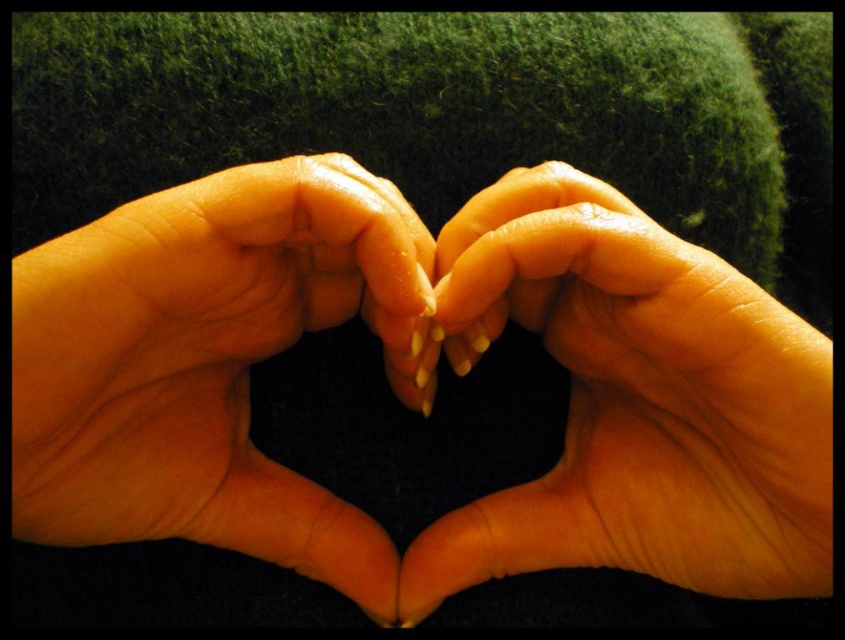
Does smooth skin hand at center have a smaller size compared to smooth skin hands at center?

No, smooth skin hand at center is not smaller than smooth skin hands at center.

Between smooth skin hand at center and smooth skin hands at center, which one is positioned higher?

smooth skin hand at center

This screenshot has width=845, height=640. What do you see at coordinates (206, 364) in the screenshot?
I see `smooth skin hand at center` at bounding box center [206, 364].

Image resolution: width=845 pixels, height=640 pixels. Identify the location of smooth skin hand at center. (206, 364).